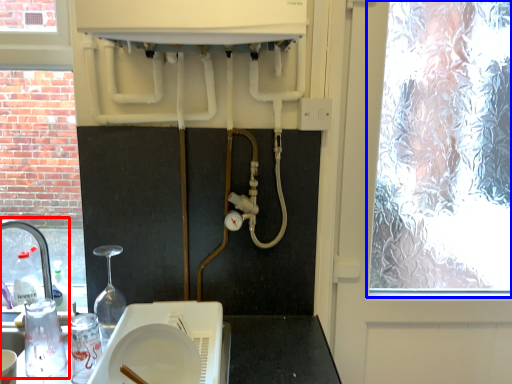
Question: Which of the following is the closest to the observer, sink (highlighted by a red box) or window (highlighted by a blue box)?

Choices:
 (A) sink
 (B) window

Answer: (A)